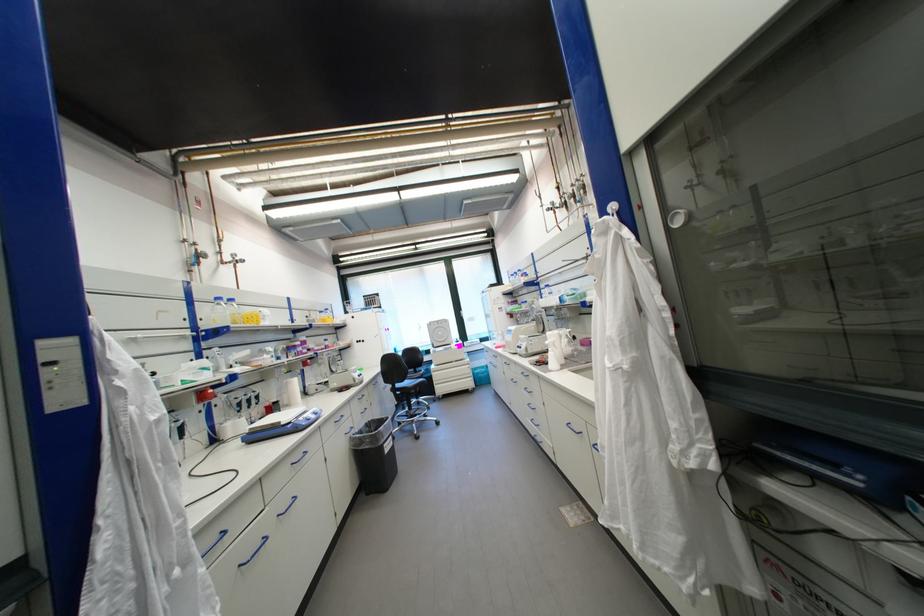
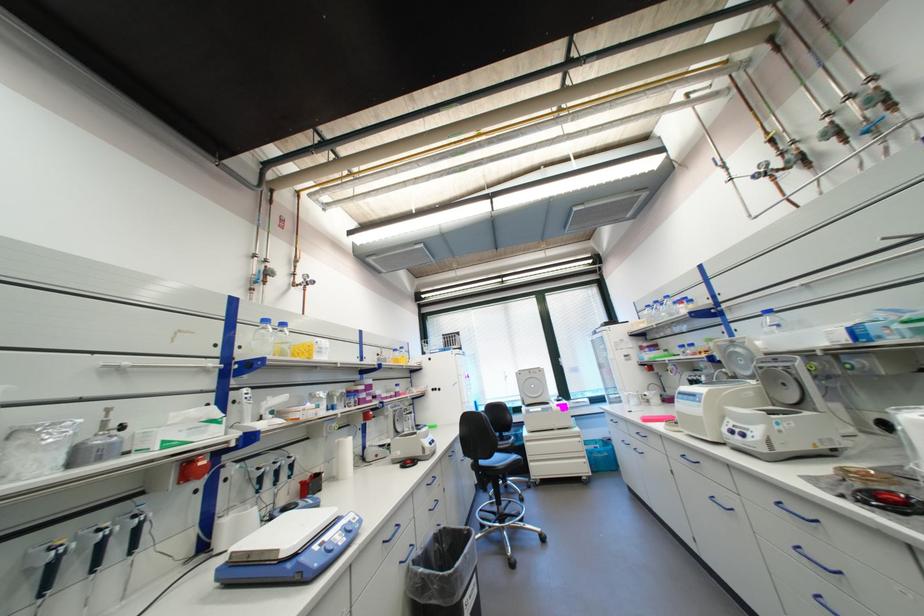
Find the pixel in the second image that matches [309,419] in the first image.

(323, 548)